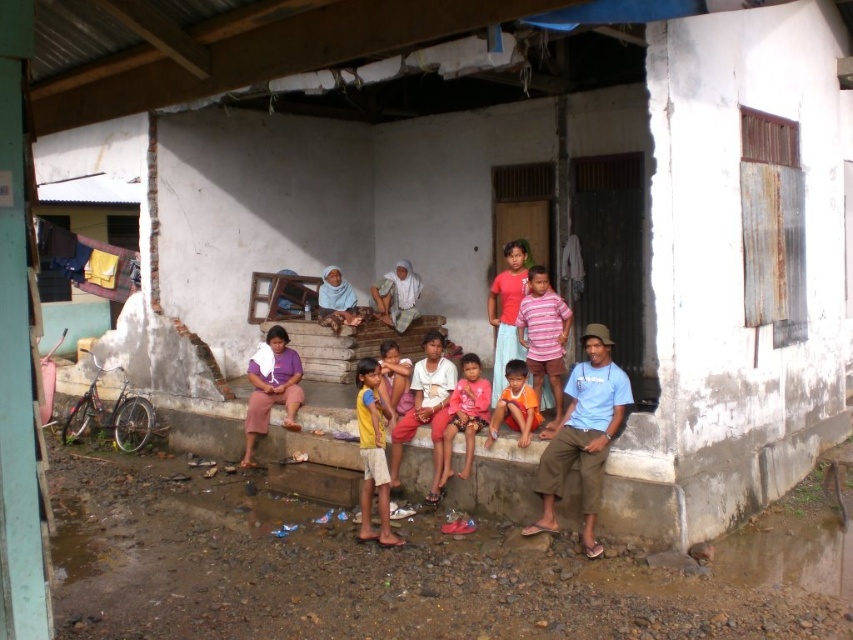
You are organizing a photo shoot and need to know which of the two shirts at the center of the image is larger. The shirts are the matte pink shirt at center and the orange cotton shirt at center. Can you determine which one is larger?

The matte pink shirt at center is bigger than the orange cotton shirt at center, so the matte pink shirt at center is the larger one.